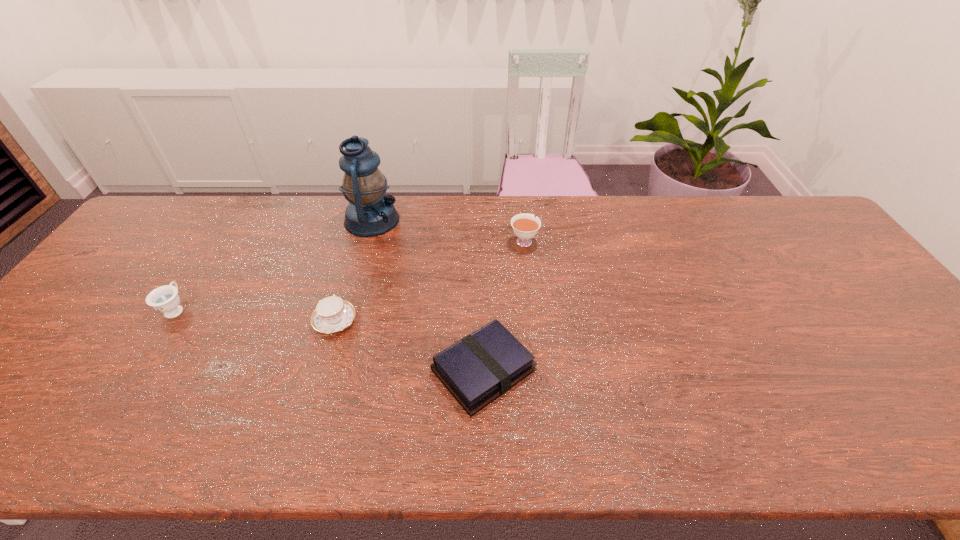
The height and width of the screenshot is (540, 960). What are the coordinates of `vacant region between the rightmost teacup and the second teacup from left to right` in the screenshot? It's located at (429, 281).

The image size is (960, 540). In order to click on empty space that is in between the rightmost teacup and the leftmost teacup in this screenshot , I will do `click(350, 275)`.

Locate an element on the screen. The image size is (960, 540). vacant area that lies between the lantern and the leftmost object is located at coordinates (274, 265).

Locate an element on the screen. free spot between the farthest teacup and the tallest object is located at coordinates (448, 231).

Locate which object ranks second in proximity to the farthest teacup. Please provide its 2D coordinates. Your answer should be formatted as a tuple, i.e. [(x, y)], where the tuple contains the x and y coordinates of a point satisfying the conditions above.

[(370, 212)]

Point out which object is positioned as the third nearest to the rightmost teacup. Please provide its 2D coordinates. Your answer should be formatted as a tuple, i.e. [(x, y)], where the tuple contains the x and y coordinates of a point satisfying the conditions above.

[(332, 314)]

The image size is (960, 540). I want to click on teacup that stands as the second closest to the farthest teacup, so click(x=165, y=299).

Identify which teacup is the second closest to the second teacup from right to left. Please provide its 2D coordinates. Your answer should be formatted as a tuple, i.e. [(x, y)], where the tuple contains the x and y coordinates of a point satisfying the conditions above.

[(525, 226)]

Find the location of a particular element. blank area in the image that satisfies the following two spatial constraints: 1. on the face of the lantern; 2. on the back side of the book is located at coordinates (330, 370).

Image resolution: width=960 pixels, height=540 pixels. I want to click on free space that satisfies the following two spatial constraints: 1. on the face of the tallest object; 2. on the side of the farthest teacup with the handle, so click(366, 241).